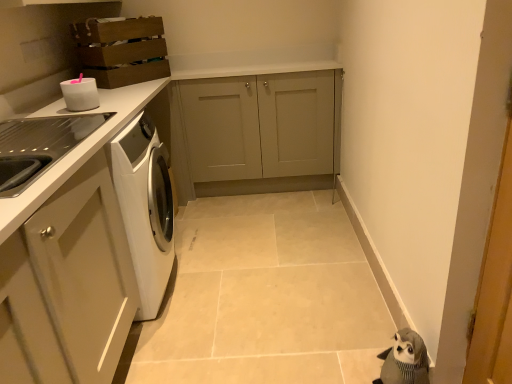
Question: Considering the relative sizes of white glossy container at upper left and white glossy countertop at left in the image provided, is white glossy container at upper left smaller than white glossy countertop at left?

Choices:
 (A) yes
 (B) no

Answer: (A)

Question: From a real-world perspective, is white glossy container at upper left below white glossy countertop at left?

Choices:
 (A) yes
 (B) no

Answer: (B)

Question: Can you confirm if white glossy container at upper left is positioned to the right of white glossy countertop at left?

Choices:
 (A) yes
 (B) no

Answer: (B)

Question: Considering the relative sizes of white glossy container at upper left and white glossy countertop at left in the image provided, is white glossy container at upper left shorter than white glossy countertop at left?

Choices:
 (A) yes
 (B) no

Answer: (A)

Question: Does white glossy container at upper left have a greater height compared to white glossy countertop at left?

Choices:
 (A) yes
 (B) no

Answer: (B)

Question: Is white glossy container at upper left behind white glossy countertop at left?

Choices:
 (A) yes
 (B) no

Answer: (A)

Question: From a real-world perspective, does white glossy countertop at left stand above matte gray cabinet at center, placed as the first cabinetry when sorted from right to left?

Choices:
 (A) no
 (B) yes

Answer: (A)

Question: Does white glossy countertop at left turn towards matte gray cabinet at center, placed as the first cabinetry when sorted from right to left?

Choices:
 (A) yes
 (B) no

Answer: (B)

Question: Could matte gray cabinet at center, the second cabinetry viewed from the left, be considered to be inside white glossy countertop at left?

Choices:
 (A) no
 (B) yes

Answer: (A)

Question: Is white glossy countertop at left positioned in front of matte gray cabinet at center, placed as the first cabinetry when sorted from right to left?

Choices:
 (A) yes
 (B) no

Answer: (A)

Question: Considering the relative sizes of white glossy countertop at left and matte gray cabinet at center, the second cabinetry viewed from the left, in the image provided, is white glossy countertop at left wider than matte gray cabinet at center, the second cabinetry viewed from the left,?

Choices:
 (A) no
 (B) yes

Answer: (B)

Question: Does white glossy countertop at left appear on the right side of matte gray cabinet at center, placed as the first cabinetry when sorted from right to left?

Choices:
 (A) no
 (B) yes

Answer: (A)

Question: Does wooden crate at upper left, the second cabinetry when ordered from right to left, have a lesser height compared to matte gray cabinet at center, placed as the first cabinetry when sorted from right to left?

Choices:
 (A) no
 (B) yes

Answer: (B)